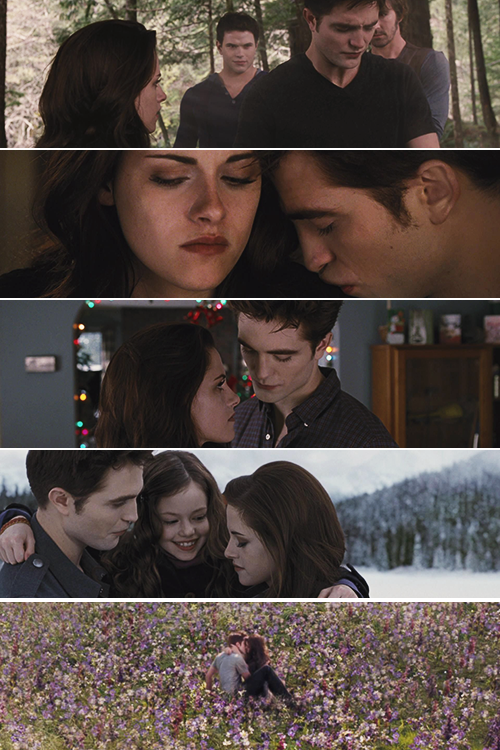
At what (x,y) coordinates should I click in order to perform the action: click on window. Please return your answer as a coordinate pair (x, y). Looking at the image, I should click on (89, 350).